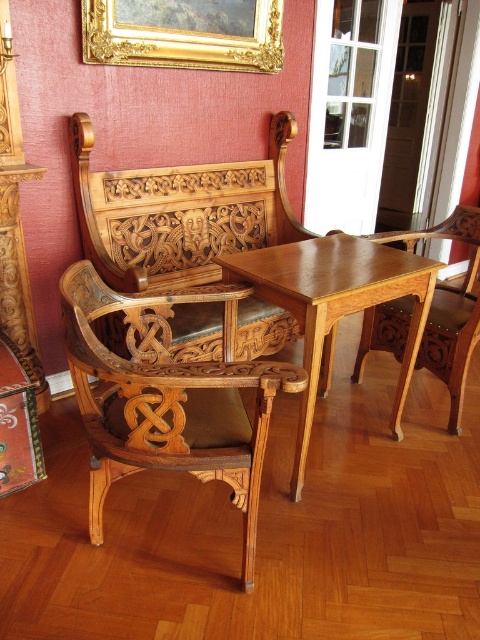
You are trying to rearrange the furniture in the room. If you want to move the natural wood armchair at center away from the light brown wood table at center, which direction should you move it?

The natural wood armchair at center is positioned under the light brown wood table at center, so to move it away, you should move the natural wood armchair at center downward or backward from the table.

You are a guest entering the room and want to sit down on the light brown wood armchair at center. However, you notice the light brown wood table at center is in your way. Can you step around the table to reach the chair without moving the table?

The light brown wood table at center is much taller than the light brown wood armchair at center, so it might block your path. However, since tables are typically lower than chairs for sitting, this description might be inaccurate. Assuming the given height difference, you would need to step around the table carefully, ensuring there is enough space around it to maneuver to the chair.